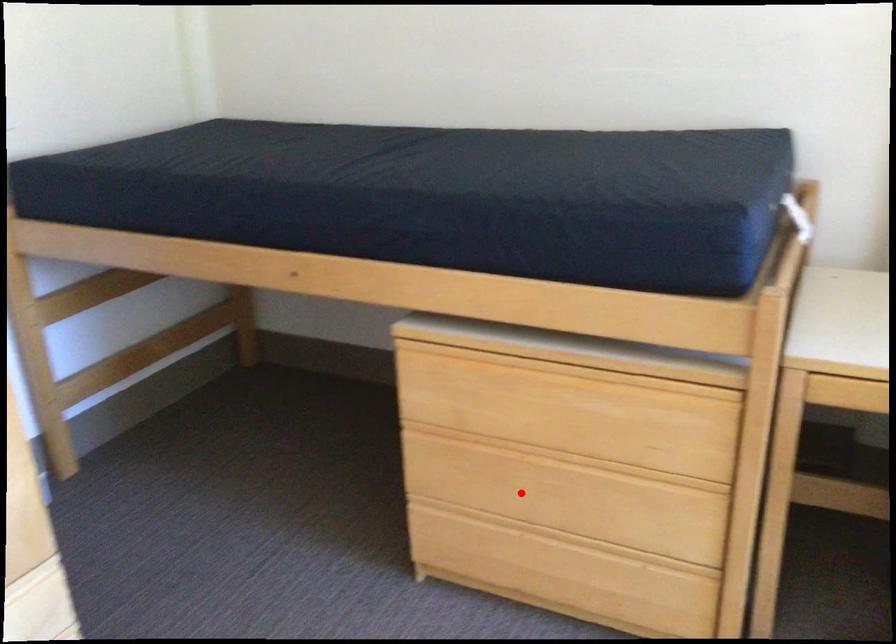
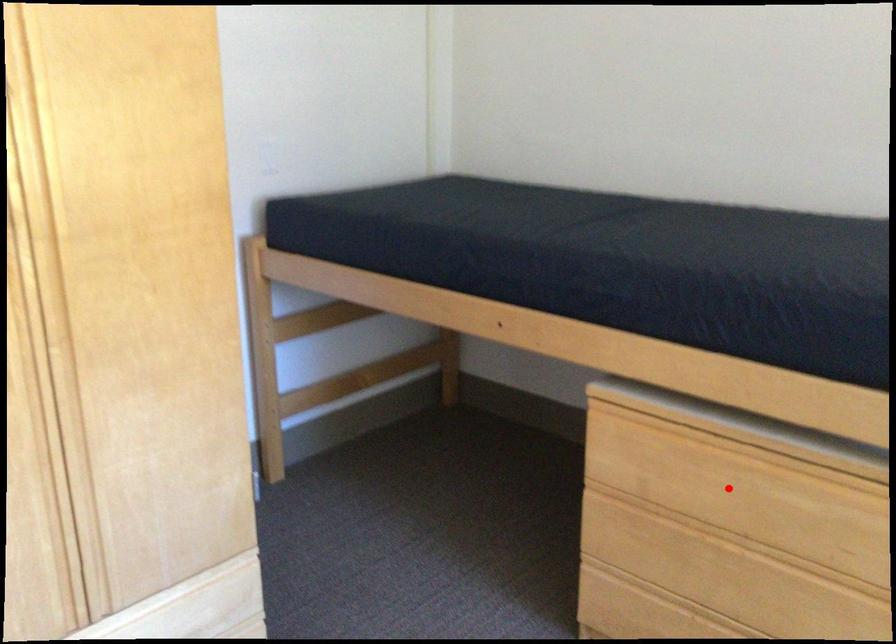
I am providing you with two images of the same scene from different viewpoints. A red point is marked on the first image and another point is marked on the second image. Is the red point in image1 aligned with the point shown in image2?

No